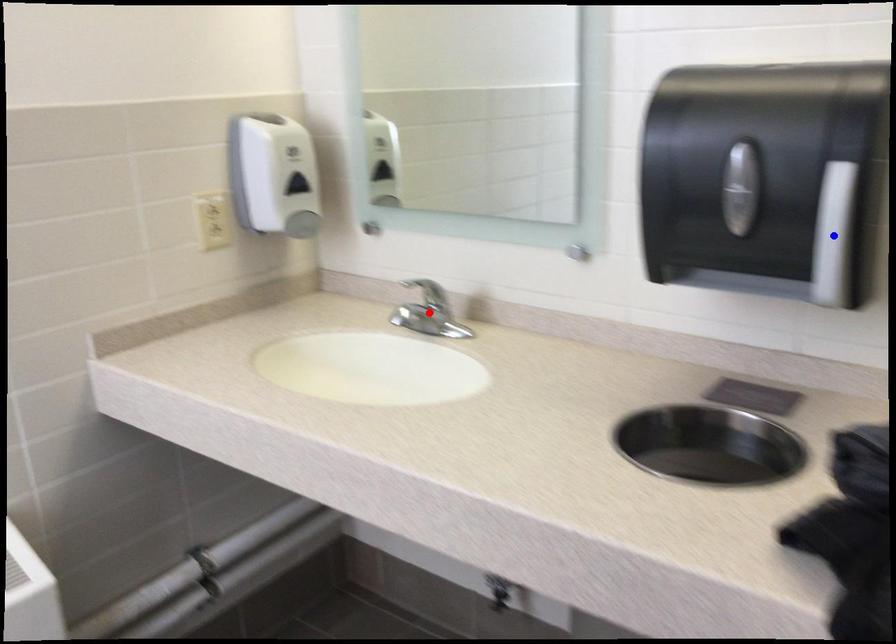
Question: In the image, two points are highlighted. Which point is nearer to the camera? Reply with the corresponding letter.

Choices:
 (A) blue point
 (B) red point

Answer: (A)